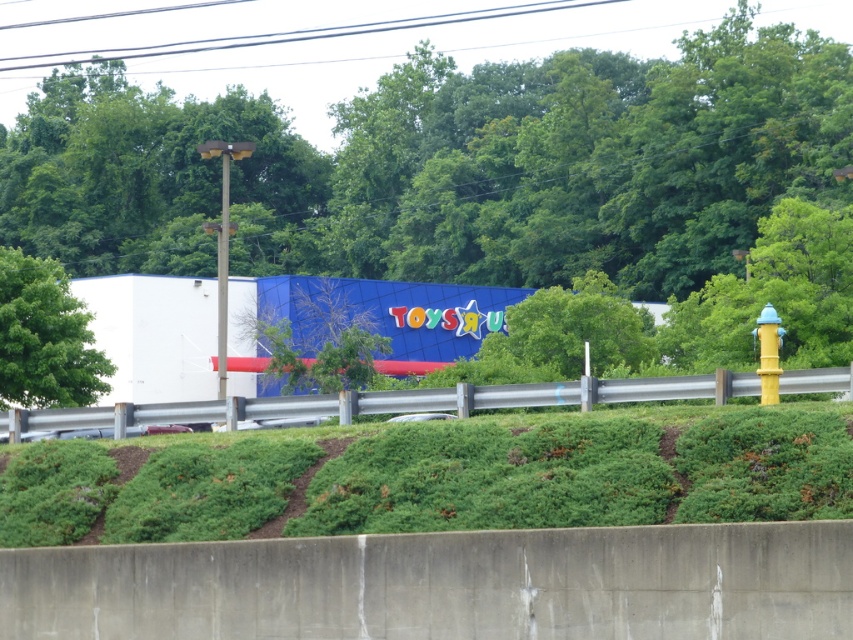
Question: Can you confirm if metallic gray guardrail at center is positioned to the left of green leafy tree at left?

Choices:
 (A) no
 (B) yes

Answer: (A)

Question: Among these objects, which one is farthest from the camera?

Choices:
 (A) green shrubbery at center
 (B) green leafy tree at left
 (C) green leafy tree at center
 (D) metallic gray guardrail at center

Answer: (C)

Question: Which object is positioned closest to the green shrubbery at center?

Choices:
 (A) metallic gray guardrail at center
 (B) green leafy tree at left
 (C) green leafy tree at center

Answer: (A)

Question: Among these objects, which one is nearest to the camera?

Choices:
 (A) green leafy tree at center
 (B) green leafy tree at left
 (C) metallic gray guardrail at center
 (D) green shrubbery at center

Answer: (D)

Question: Does green shrubbery at center lie behind green leafy tree at left?

Choices:
 (A) no
 (B) yes

Answer: (A)

Question: Does green shrubbery at center appear on the right side of metallic gray guardrail at center?

Choices:
 (A) no
 (B) yes

Answer: (B)